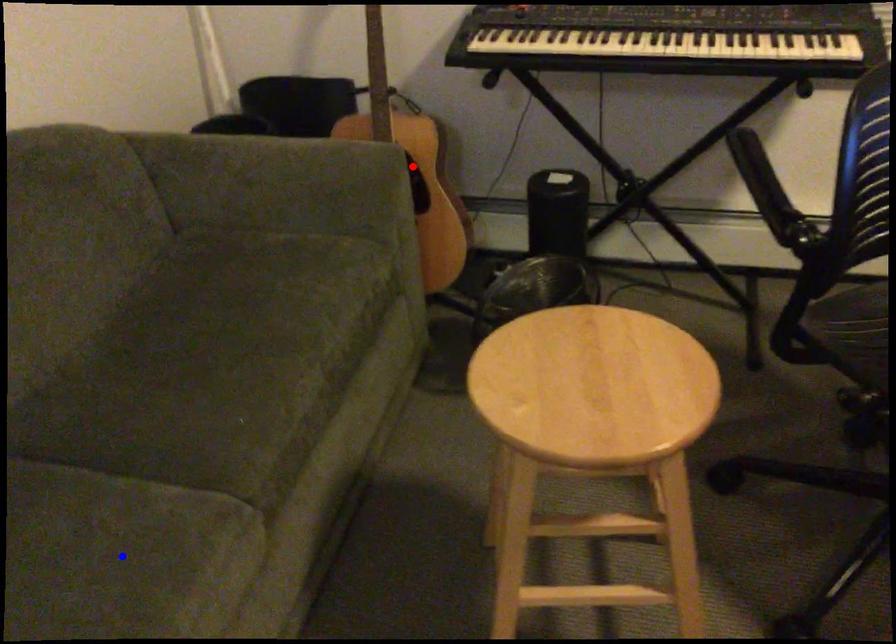
Question: Which of the two points in the image is closer to the camera?

Choices:
 (A) Blue point is closer.
 (B) Red point is closer.

Answer: (A)